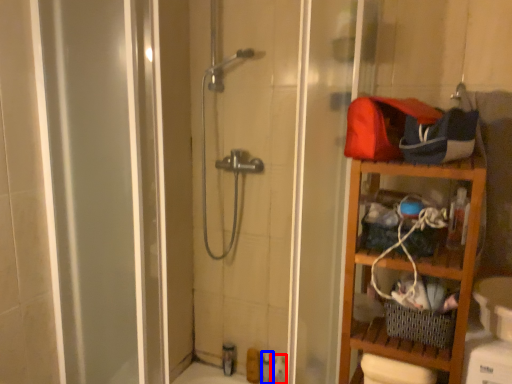
Question: Which point is closer to the camera, toiletry (highlighted by a red box) or toiletry (highlighted by a blue box)?

Choices:
 (A) toiletry
 (B) toiletry

Answer: (A)